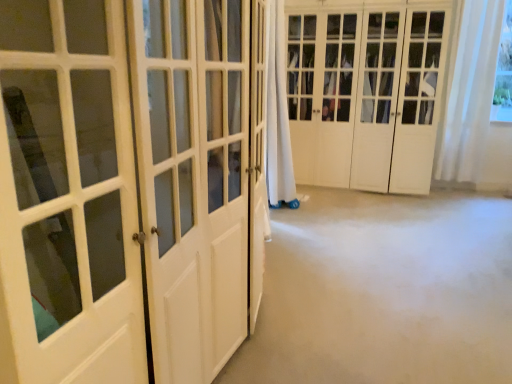
Measure the distance between point (x=157, y=250) and camera.

Point (x=157, y=250) and camera are 1.10 meters apart from each other.

At what (x,y) coordinates should I click in order to perform the action: click on white glossy door at left, the 1th door when ordered from left to right. Please return your answer as a coordinate pair (x, y). Image resolution: width=512 pixels, height=384 pixels. Looking at the image, I should click on (129, 187).

Describe the element at coordinates (473, 102) in the screenshot. I see `white sheer curtain at upper right` at that location.

The image size is (512, 384). I want to click on white glossy door at left, which appears as the 2th door when viewed from the back, so click(129, 187).

Consider the image. Which object is further away from the camera taking this photo, white wood closet doors at center, which appears as the second door when viewed from the left, or white sheer curtain at upper right?

white sheer curtain at upper right.

From a real-world perspective, is white wood closet doors at center, which appears as the second door when viewed from the left, on top of white sheer curtain at upper right?

No, from a real-world perspective, white wood closet doors at center, which appears as the second door when viewed from the left, is not over white sheer curtain at upper right

Based on their sizes in the image, would you say white wood closet doors at center, the 2th door in the front-to-back sequence, is bigger or smaller than white sheer curtain at upper right?

white wood closet doors at center, the 2th door in the front-to-back sequence, is bigger than white sheer curtain at upper right.

From their relative heights in the image, would you say white wood closet doors at center, the 2th door in the front-to-back sequence, is taller or shorter than white sheer curtain at upper right?

In the image, white wood closet doors at center, the 2th door in the front-to-back sequence, appears to be taller than white sheer curtain at upper right.

Who is smaller, white wood closet doors at center, the first door positioned from the right, or white glossy door at left, the 1th door when ordered from left to right?

With smaller size is white glossy door at left, the 1th door when ordered from left to right.

Is white wood closet doors at center, the first door positioned from the right, positioned far away from white glossy door at left, the 2th door when ordered from right to left?

white wood closet doors at center, the first door positioned from the right, is far away from white glossy door at left, the 2th door when ordered from right to left.

Who is more distant, white wood closet doors at center, the 2th door in the front-to-back sequence, or white glossy door at left, the 1th door when ordered from left to right?

white wood closet doors at center, the 2th door in the front-to-back sequence, is further from the camera.

From a real-world perspective, which object rests below the other?

white glossy door at left, the 2th door when ordered from right to left.

Considering the relative sizes of white sheer curtain at upper right and white glossy door at left, which appears as the 2th door when viewed from the back, in the image provided, is white sheer curtain at upper right shorter than white glossy door at left, which appears as the 2th door when viewed from the back,?

Incorrect, the height of white sheer curtain at upper right does not fall short of that of white glossy door at left, which appears as the 2th door when viewed from the back.

Is white sheer curtain at upper right bigger than white glossy door at left, which appears as the 2th door when viewed from the back?

Incorrect, white sheer curtain at upper right is not larger than white glossy door at left, which appears as the 2th door when viewed from the back.

Between white sheer curtain at upper right and white glossy door at left, the 1th door when ordered from left to right, which one appears on the right side from the viewer's perspective?

From the viewer's perspective, white sheer curtain at upper right appears more on the right side.

What's the angular difference between white sheer curtain at upper right and white glossy door at left, arranged as the first door when viewed from the front,'s facing directions?

The angle between the facing direction of white sheer curtain at upper right and the facing direction of white glossy door at left, arranged as the first door when viewed from the front, is 91.7 degrees.

Which object is more forward, white glossy door at left, which appears as the 2th door when viewed from the back, or white wood closet doors at center, the first door positioned from the right?

white glossy door at left, which appears as the 2th door when viewed from the back, is more forward.

The image size is (512, 384). Find the location of `door that appears above the white glossy door at left, the 1th door when ordered from left to right (from the image's perspective)`. door that appears above the white glossy door at left, the 1th door when ordered from left to right (from the image's perspective) is located at coordinates (365, 92).

Is white glossy door at left, arranged as the first door when viewed from the front, oriented towards white wood closet doors at center, the first door positioned from the right?

No, white glossy door at left, arranged as the first door when viewed from the front, is not aimed at white wood closet doors at center, the first door positioned from the right.

Considering the positions of objects white glossy door at left, the 1th door when ordered from left to right, and white wood closet doors at center, the first door positioned from the right, in the image provided, who is more to the left, white glossy door at left, the 1th door when ordered from left to right, or white wood closet doors at center, the first door positioned from the right,?

From the viewer's perspective, white glossy door at left, the 1th door when ordered from left to right, appears more on the left side.

Can you confirm if white sheer curtain at upper right is smaller than white wood closet doors at center, the first door positioned from the right?

Indeed, white sheer curtain at upper right has a smaller size compared to white wood closet doors at center, the first door positioned from the right.

Is white sheer curtain at upper right facing away from white wood closet doors at center, the first door positioned from the right?

white sheer curtain at upper right does not have its back to white wood closet doors at center, the first door positioned from the right.

Would you consider white sheer curtain at upper right to be distant from white wood closet doors at center, the 2th door in the front-to-back sequence?

No.

Which object is thinner, white sheer curtain at upper right or white wood closet doors at center, which appears as the second door when viewed from the left?

white sheer curtain at upper right is thinner.

Is white glossy door at left, arranged as the first door when viewed from the front, at the left side of white sheer curtain at upper right?

Indeed, white glossy door at left, arranged as the first door when viewed from the front, is positioned on the left side of white sheer curtain at upper right.

Considering the relative sizes of white glossy door at left, the 1th door when ordered from left to right, and white sheer curtain at upper right in the image provided, is white glossy door at left, the 1th door when ordered from left to right, thinner than white sheer curtain at upper right?

In fact, white glossy door at left, the 1th door when ordered from left to right, might be wider than white sheer curtain at upper right.

Identify the location of curtain lying below the white wood closet doors at center, the first door positioned from the right (from the image's perspective). The height and width of the screenshot is (384, 512). (473, 102).

Locate an element on the screen. door behind the white glossy door at left, the 2th door when ordered from right to left is located at coordinates (365, 92).

Estimate the real-world distances between objects in this image. Which object is further from white glossy door at left, which appears as the 2th door when viewed from the back, white sheer curtain at upper right or white wood closet doors at center, the 2th door in the front-to-back sequence?

white sheer curtain at upper right is positioned further to the anchor white glossy door at left, which appears as the 2th door when viewed from the back.

Based on their spatial positions, is white glossy door at left, which appears as the 2th door when viewed from the back, or white wood closet doors at center, the first door positioned from the back, closer to white sheer curtain at upper right?

white wood closet doors at center, the first door positioned from the back, lies closer to white sheer curtain at upper right than the other object.

Which object lies further to the anchor point white wood closet doors at center, which appears as the second door when viewed from the left, white sheer curtain at upper right or white glossy door at left, the 1th door when ordered from left to right?

white glossy door at left, the 1th door when ordered from left to right, is positioned further to the anchor white wood closet doors at center, which appears as the second door when viewed from the left.

Based on the photo, which object lies further to the anchor point white wood closet doors at center, the first door positioned from the back, white glossy door at left, arranged as the first door when viewed from the front, or white sheer curtain at upper right?

Among the two, white glossy door at left, arranged as the first door when viewed from the front, is located further to white wood closet doors at center, the first door positioned from the back.

Looking at the image, which one is located closer to white sheer curtain at upper right, white wood closet doors at center, the first door positioned from the right, or white glossy door at left, arranged as the first door when viewed from the front?

white wood closet doors at center, the first door positioned from the right, is closer to white sheer curtain at upper right.

From the picture: From the image, which object appears to be farther from white glossy door at left, arranged as the first door when viewed from the front, white wood closet doors at center, the 2th door in the front-to-back sequence, or white sheer curtain at upper right?

white sheer curtain at upper right lies further to white glossy door at left, arranged as the first door when viewed from the front, than the other object.

Locate an element on the screen. door between white glossy door at left, arranged as the first door when viewed from the front, and white sheer curtain at upper right in the front-back direction is located at coordinates (365, 92).